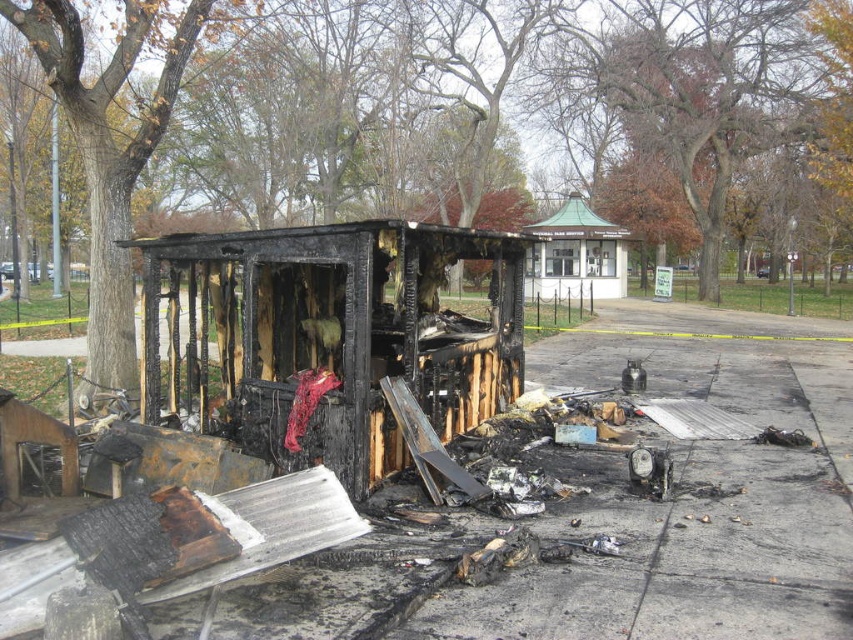
Question: Which point is closer to the camera?

Choices:
 (A) (405, 276)
 (B) (595, 268)

Answer: (A)

Question: Which of the following is the closest to the observer?

Choices:
 (A) (354, 460)
 (B) (579, 259)

Answer: (A)

Question: Is charcoal wood gazebo at center closer to camera compared to green metal gazebo at upper center?

Choices:
 (A) yes
 (B) no

Answer: (A)

Question: Can you confirm if charcoal wood gazebo at center is positioned to the left of green metal gazebo at upper center?

Choices:
 (A) no
 (B) yes

Answer: (B)

Question: Is charcoal wood gazebo at center to the right of green metal gazebo at upper center from the viewer's perspective?

Choices:
 (A) yes
 (B) no

Answer: (B)